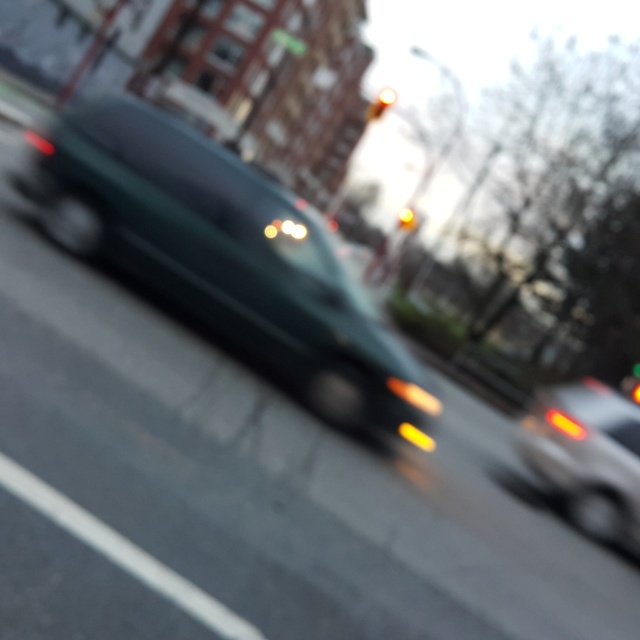
Question: Can you confirm if dark green matte van at center is smaller than matte silver car at right?

Choices:
 (A) yes
 (B) no

Answer: (A)

Question: Is yellow glass traffic light at upper center in front of yellow glass traffic light at center?

Choices:
 (A) no
 (B) yes

Answer: (B)

Question: Which point is farther to the camera?

Choices:
 (A) yellow glass traffic light at center
 (B) matte silver car at right
 (C) yellow glass traffic light at upper center
 (D) dark green matte van at center

Answer: (A)

Question: Which point is closer to the camera taking this photo?

Choices:
 (A) (374, 112)
 (B) (584, 417)

Answer: (B)

Question: Does dark green matte van at center appear on the left side of yellow glass traffic light at center?

Choices:
 (A) yes
 (B) no

Answer: (A)

Question: Which is farther from the yellow glass traffic light at upper center?

Choices:
 (A) matte silver car at right
 (B) yellow glass traffic light at center

Answer: (A)